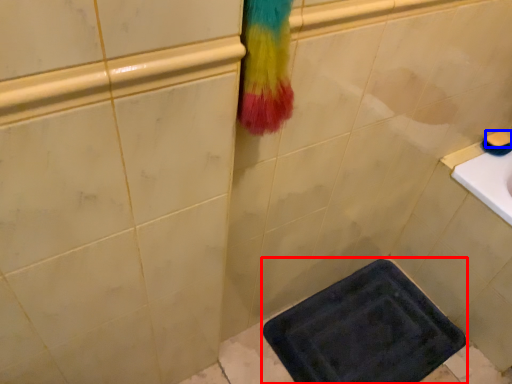
Question: Which object is further to the camera taking this photo, bath mat (highlighted by a red box) or soap (highlighted by a blue box)?

Choices:
 (A) bath mat
 (B) soap

Answer: (B)